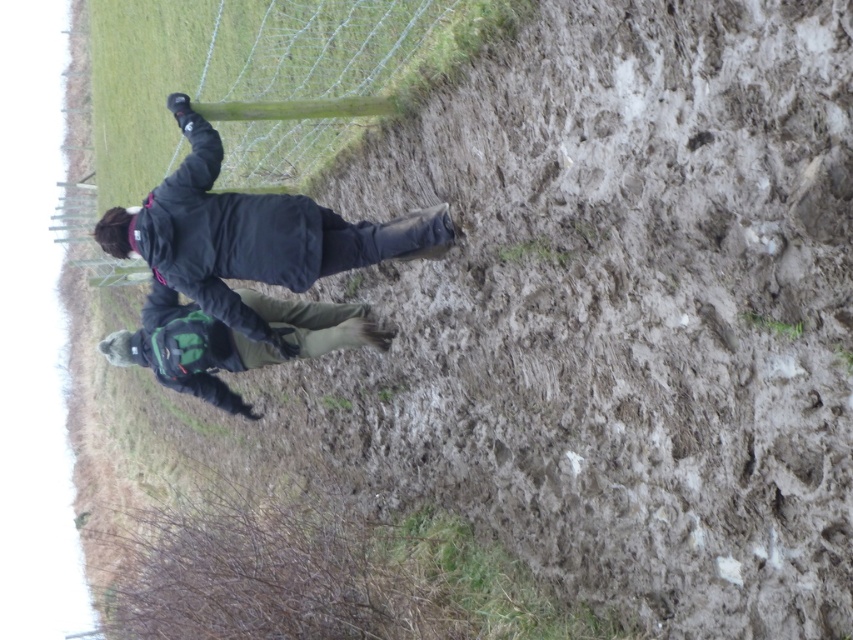
You are a hiker who needs to pass between the dark gray fabric jacket at center and the dark green fabric jacket at center. The path between them is narrow. If your backpack is 28 inches wide, will you fit through the space?

The dark gray fabric jacket at center and dark green fabric jacket at center are 30.38 inches apart from each other. Since your backpack is 28 inches wide, you can fit through the space between them as it is wider than your backpack.

You are planning to buy a jacket for a hiking trip. You see two jackets in the image, a dark gray fabric jacket at center and a dark green fabric jacket at center. Which jacket would be more suitable for a hiker needing a larger size?

The dark gray fabric jacket at center is larger in size than the dark green fabric jacket at center, so it would be more suitable for a hiker needing a larger size.

You are standing at the viewpoint where the image was taken. There is a dark gray fabric jacket at center. If you want to reach the jacket, how many steps would you need to take if each step covers 0.75 meters?

The dark gray fabric jacket at center is 5.91 meters away. Dividing the distance by step length 5.91 divided by 0.75 equals approximately 7.88 steps. Since you can not take a fraction of a step, you would need to take 8 steps to reach the jacket.